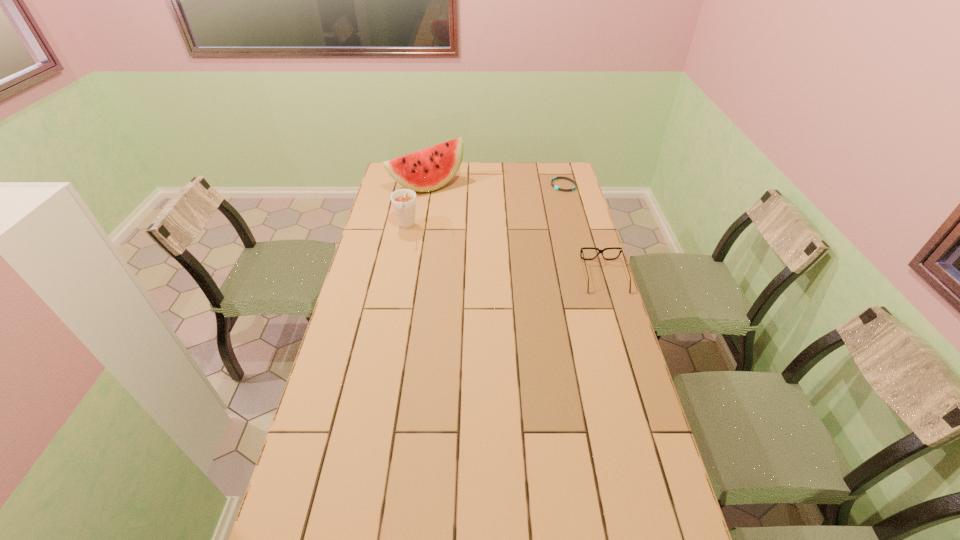
I want to click on vacant space on the desktop that is between the root beer and the nearest object and is positioned on the outer rind of the watermelon, so click(494, 249).

You are a GUI agent. You are given a task and a screenshot of the screen. Output one action in this format:
    pyautogui.click(x=<x>, y=<y>)
    Task: Click on the free space on the desktop that is between the root beer and the second shortest object and is positioned on the buckle of the wristband
    
    Given the screenshot: What is the action you would take?
    pyautogui.click(x=490, y=248)